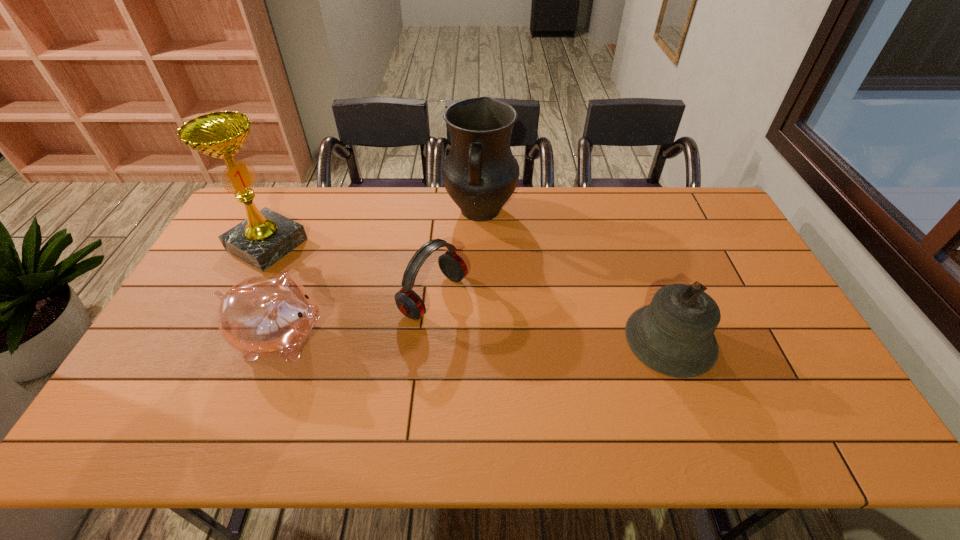
Locate an element on the screen. This screenshot has height=540, width=960. vacant space on the desktop that is between the piggy bank and the rightmost object and is positioned on the ear cups of the earphone is located at coordinates (506, 340).

Where is `free space on the desktop that is between the piggy bank and the bell and is positioned on the front-facing side of the award`? Image resolution: width=960 pixels, height=540 pixels. free space on the desktop that is between the piggy bank and the bell and is positioned on the front-facing side of the award is located at coordinates (444, 340).

Identify the location of vacant space on the desktop that is between the piggy bank and the bell and is positioned on the handle side of the second tallest object. This screenshot has width=960, height=540. [453, 340].